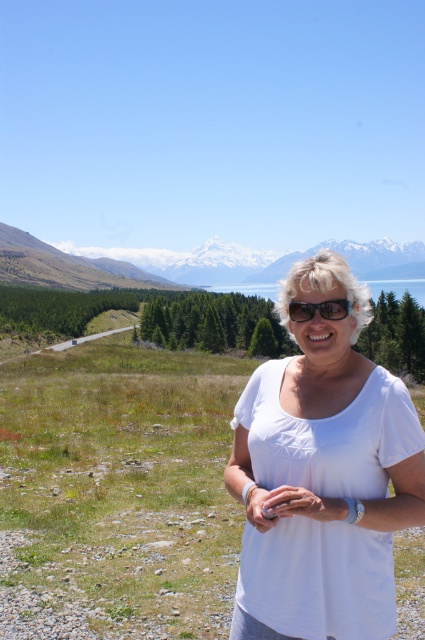
You are an outdoor photographer planning to capture a landscape shot including both the snowy granite mountain at upper left and the clear blue water at center. Your camera has a maximum focus range of 100 meters. Will you be able to focus on both subjects simultaneously?

The distance between the snowy granite mountain at upper left and the clear blue water at center is 102.22 meters. Since your camera can only focus up to 100 meters, it won